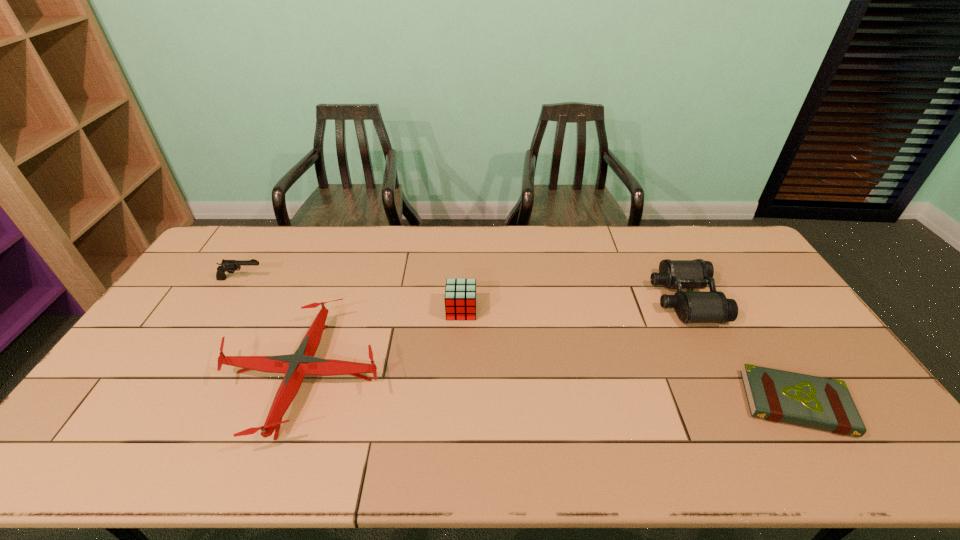
Identify the location of vacant area situated on the right of the second object from left to right. [x=475, y=376].

Where is `free spot located 0.260m on the back of the shortest object`? The image size is (960, 540). free spot located 0.260m on the back of the shortest object is located at coordinates (734, 305).

You are a GUI agent. You are given a task and a screenshot of the screen. Output one action in this format:
    pyautogui.click(x=<x>, y=<y>)
    Task: Click on the drone present at the near edge
    Image resolution: width=960 pixels, height=540 pixels.
    Given the screenshot: What is the action you would take?
    pyautogui.click(x=295, y=366)

Find the location of a particular element. The width and height of the screenshot is (960, 540). book that is at the near edge is located at coordinates (775, 395).

This screenshot has height=540, width=960. Find the location of `object at the left edge`. object at the left edge is located at coordinates coord(230,266).

Locate an element on the screen. The width and height of the screenshot is (960, 540). object that is at the right edge is located at coordinates (775, 395).

Image resolution: width=960 pixels, height=540 pixels. I want to click on object present at the near right corner, so click(x=775, y=395).

Locate an element on the screen. vacant space at the far edge of the desktop is located at coordinates (316, 238).

In the image, there is a desktop. Where is `vacant region at the near edge`? vacant region at the near edge is located at coordinates coord(241,457).

Identify the location of free space at the left edge. Image resolution: width=960 pixels, height=540 pixels. (184, 326).